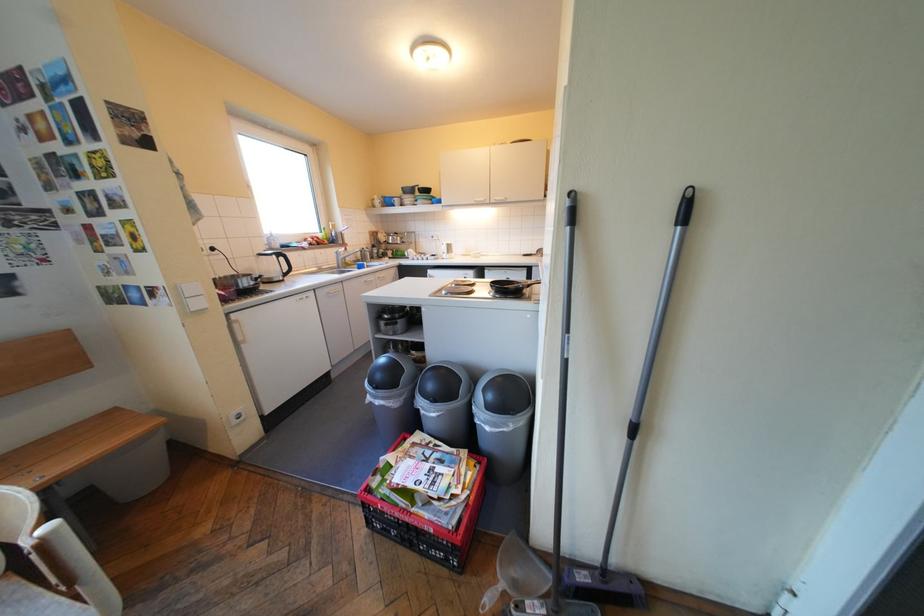
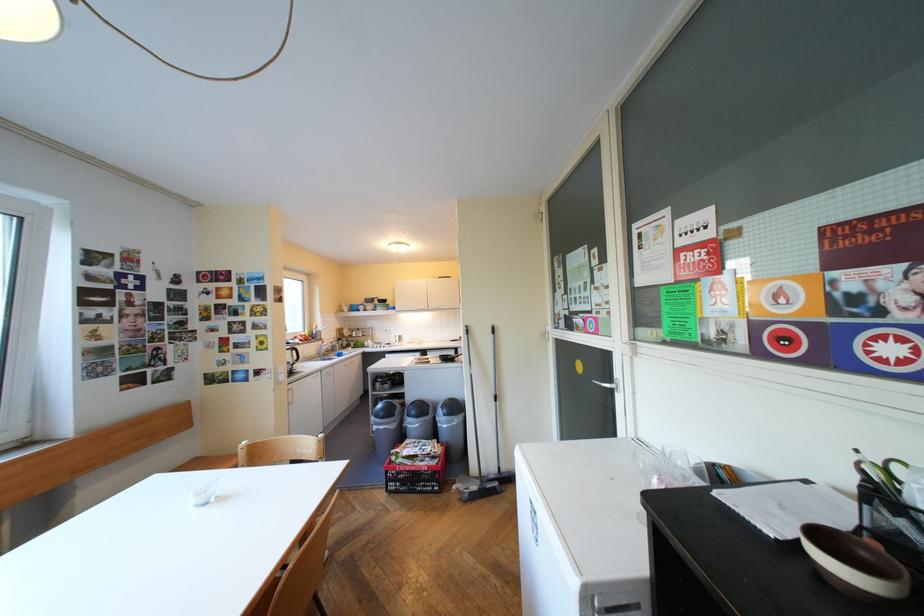
Where in the second image is the point corresponding to point 405,456 from the first image?

(410, 448)